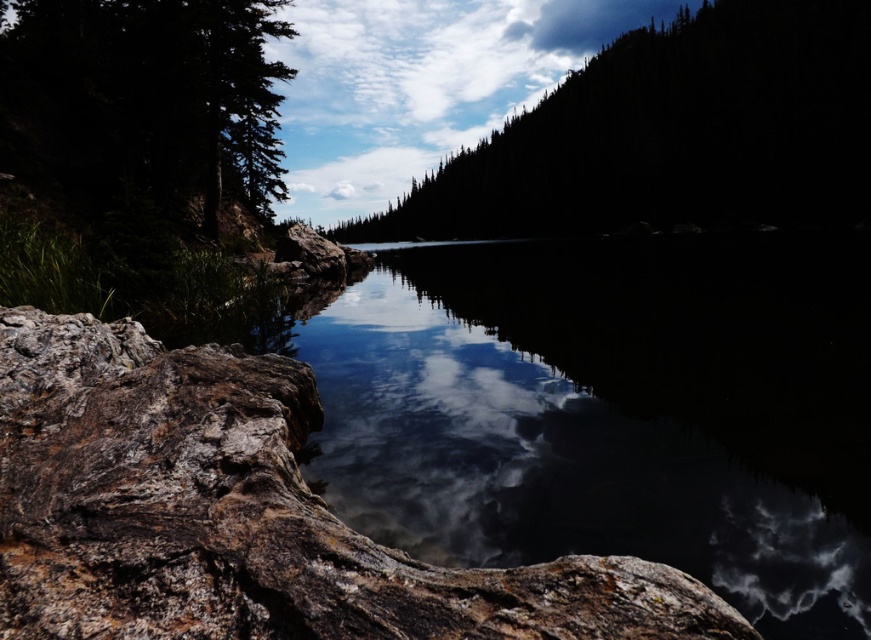
Question: Which object appears closest to the camera in this image?

Choices:
 (A) green matte tree at upper left
 (B) green textured trees at upper center
 (C) transparent glass water at center

Answer: (C)

Question: Is transparent glass water at center in front of green textured trees at upper center?

Choices:
 (A) yes
 (B) no

Answer: (A)

Question: Estimate the real-world distances between objects in this image. Which object is farther from the transparent glass water at center?

Choices:
 (A) green matte tree at upper left
 (B) green textured trees at upper center

Answer: (B)

Question: Which is nearer to the green textured trees at upper center?

Choices:
 (A) green matte tree at upper left
 (B) transparent glass water at center

Answer: (B)

Question: Is transparent glass water at center below green textured trees at upper center?

Choices:
 (A) no
 (B) yes

Answer: (B)

Question: Can you confirm if transparent glass water at center is positioned to the right of green matte tree at upper left?

Choices:
 (A) no
 (B) yes

Answer: (B)